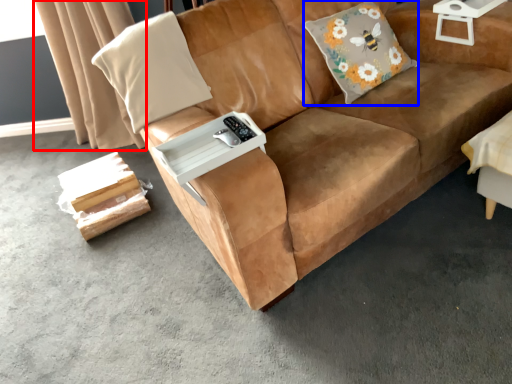
Question: Which object is further to the camera taking this photo, curtain (highlighted by a red box) or throw pillow (highlighted by a blue box)?

Choices:
 (A) curtain
 (B) throw pillow

Answer: (A)